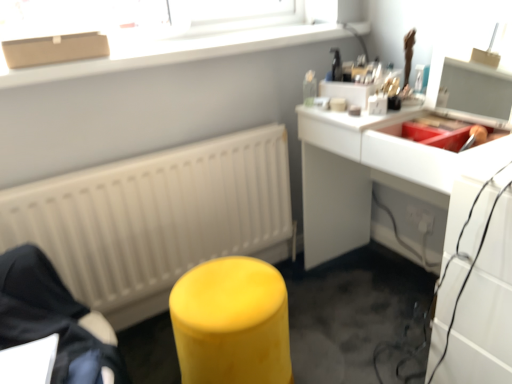
Question: In the image, is matte white window sill at upper center positioned in front of or behind matte yellow stool at center, acting as the 1th furniture starting from the right?

Choices:
 (A) front
 (B) behind

Answer: (B)

Question: Is matte white window sill at upper center wider or thinner than matte yellow stool at center, the second furniture in the left-to-right sequence?

Choices:
 (A) thin
 (B) wide

Answer: (A)

Question: Which of these objects is positioned closest to the matte white window sill at upper center?

Choices:
 (A) matte yellow stool at lower left, which appears as the first furniture when viewed from the left
 (B) white plastic electric outlet at lower right
 (C) matte white radiator at center
 (D) white glossy desk at upper right
 (E) matte yellow stool at center, the second furniture in the left-to-right sequence

Answer: (C)

Question: Which of these objects is positioned farthest from the matte white radiator at center?

Choices:
 (A) matte yellow stool at lower left, which appears as the first furniture when viewed from the left
 (B) matte white window sill at upper center
 (C) matte yellow stool at center, the second furniture in the left-to-right sequence
 (D) white glossy desk at upper right
 (E) white plastic electric outlet at lower right

Answer: (E)